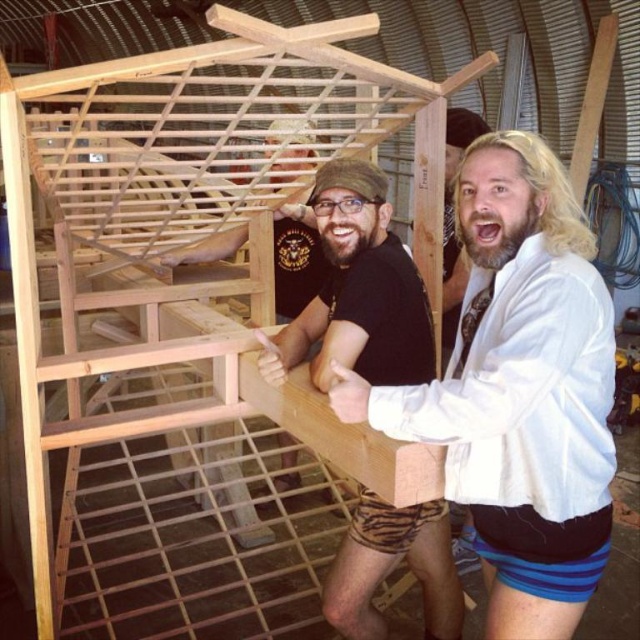
Question: Can you confirm if white matte jacket at upper right is positioned above black matte t-shirt at center?

Choices:
 (A) no
 (B) yes

Answer: (A)

Question: Which point is closer to the camera?

Choices:
 (A) click(x=541, y=147)
 (B) click(x=410, y=333)

Answer: (A)

Question: Does white matte jacket at upper right appear over black matte t-shirt at center?

Choices:
 (A) yes
 (B) no

Answer: (B)

Question: Which point is closer to the camera taking this photo?

Choices:
 (A) (369, 579)
 (B) (419, 419)

Answer: (B)

Question: Which of the following is the farthest from the observer?

Choices:
 (A) black matte t-shirt at center
 (B) white matte jacket at upper right

Answer: (A)

Question: Is white matte jacket at upper right smaller than black matte t-shirt at center?

Choices:
 (A) no
 (B) yes

Answer: (A)